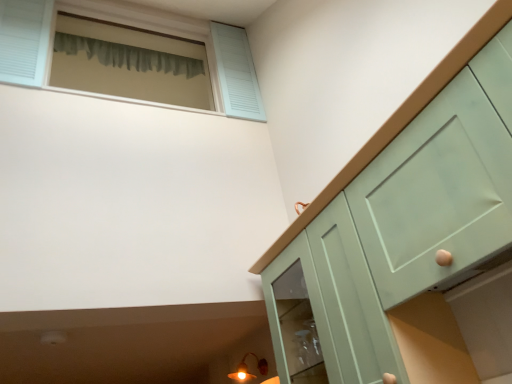
Question: From the image's perspective, does matte gold light fixture at lower left appear lower than mint green cabinet at right?

Choices:
 (A) no
 (B) yes

Answer: (B)

Question: Is matte gold light fixture at lower left not within mint green cabinet at right?

Choices:
 (A) yes
 (B) no

Answer: (A)

Question: Is matte gold light fixture at lower left facing away from mint green cabinet at right?

Choices:
 (A) no
 (B) yes

Answer: (A)

Question: From a real-world perspective, is matte gold light fixture at lower left located beneath mint green cabinet at right?

Choices:
 (A) no
 (B) yes

Answer: (A)

Question: Does matte gold light fixture at lower left appear on the right side of mint green cabinet at right?

Choices:
 (A) yes
 (B) no

Answer: (B)

Question: From a real-world perspective, is green fabric curtain at upper left above or below light blue wooden window at upper left?

Choices:
 (A) below
 (B) above

Answer: (B)

Question: Is green fabric curtain at upper left to the left or to the right of light blue wooden window at upper left in the image?

Choices:
 (A) right
 (B) left

Answer: (B)

Question: Looking at the image, does green fabric curtain at upper left seem bigger or smaller compared to light blue wooden window at upper left?

Choices:
 (A) small
 (B) big

Answer: (A)

Question: Is green fabric curtain at upper left spatially inside light blue wooden window at upper left, or outside of it?

Choices:
 (A) outside
 (B) inside

Answer: (A)

Question: From the image's perspective, is matte gold light fixture at lower left positioned above or below mint green cabinet at right?

Choices:
 (A) above
 (B) below

Answer: (B)

Question: Considering the relative positions of matte gold light fixture at lower left and mint green cabinet at right in the image provided, is matte gold light fixture at lower left to the left or to the right of mint green cabinet at right?

Choices:
 (A) right
 (B) left

Answer: (B)

Question: Looking at the image, does matte gold light fixture at lower left seem bigger or smaller compared to mint green cabinet at right?

Choices:
 (A) small
 (B) big

Answer: (A)

Question: Considering the positions of point (240, 377) and point (258, 266), is point (240, 377) closer or farther from the camera than point (258, 266)?

Choices:
 (A) farther
 (B) closer

Answer: (A)

Question: In the image, is light blue wooden window at upper left on the left side or the right side of mint green cabinet at right?

Choices:
 (A) right
 (B) left

Answer: (B)

Question: In terms of width, does light blue wooden window at upper left look wider or thinner when compared to mint green cabinet at right?

Choices:
 (A) wide
 (B) thin

Answer: (A)